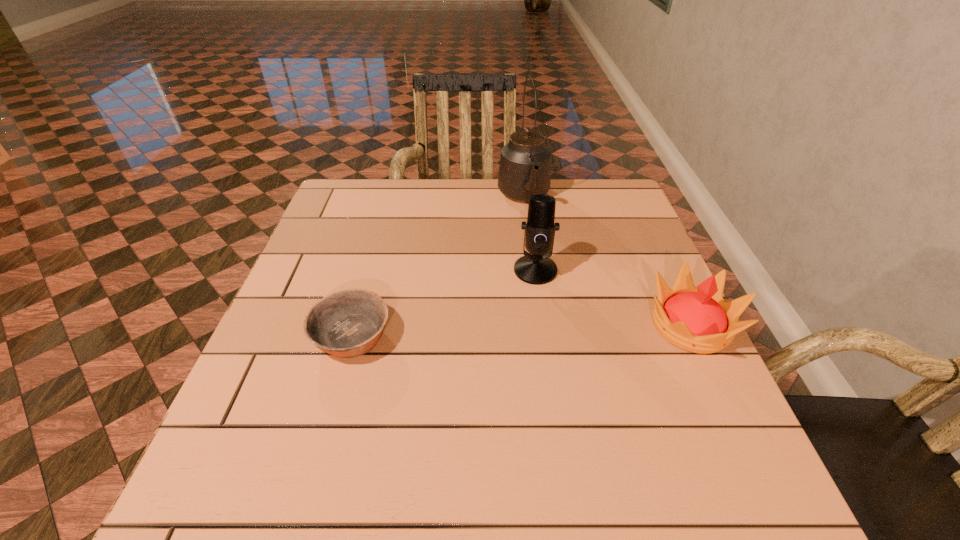
Locate an element on the screen. This screenshot has width=960, height=540. free space on the desktop that is between the leftmost object and the third tallest object and is positioned on the stand of the third shortest object is located at coordinates (517, 330).

Locate an element on the screen. This screenshot has height=540, width=960. vacant space on the desktop that is between the bowl and the rightmost object and is positioned spout on the kettle is located at coordinates (570, 329).